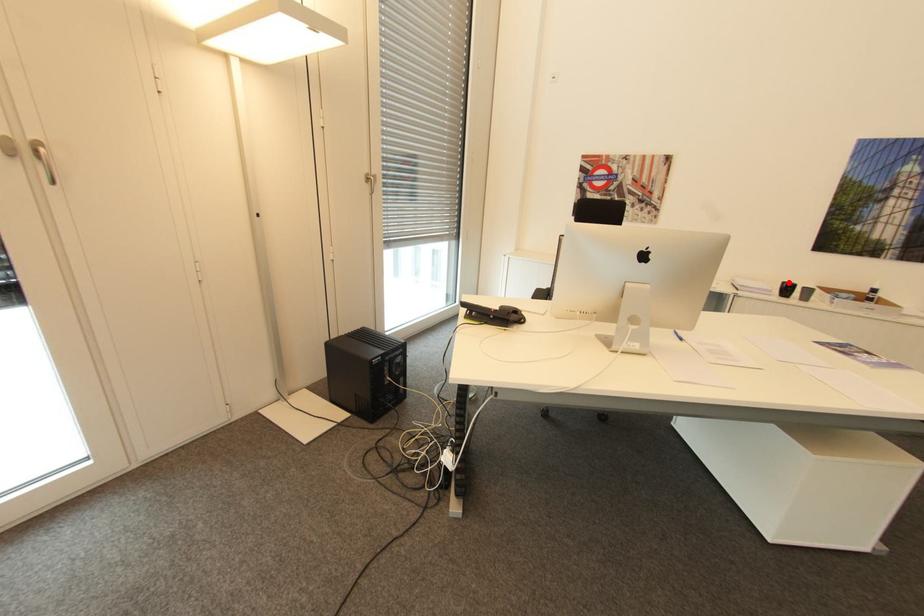
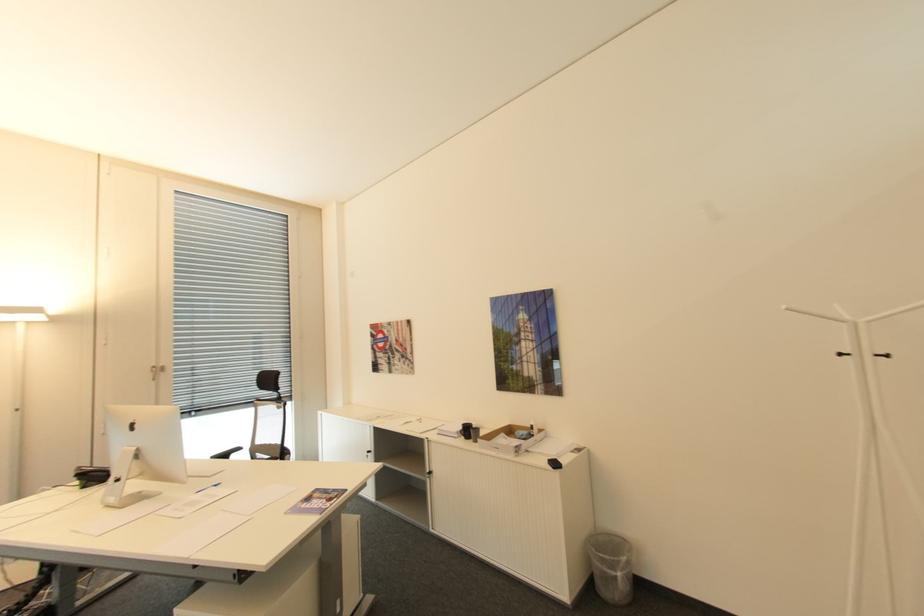
Where in the second image is the point corresponding to the highlighted location from the first image?

(468, 424)